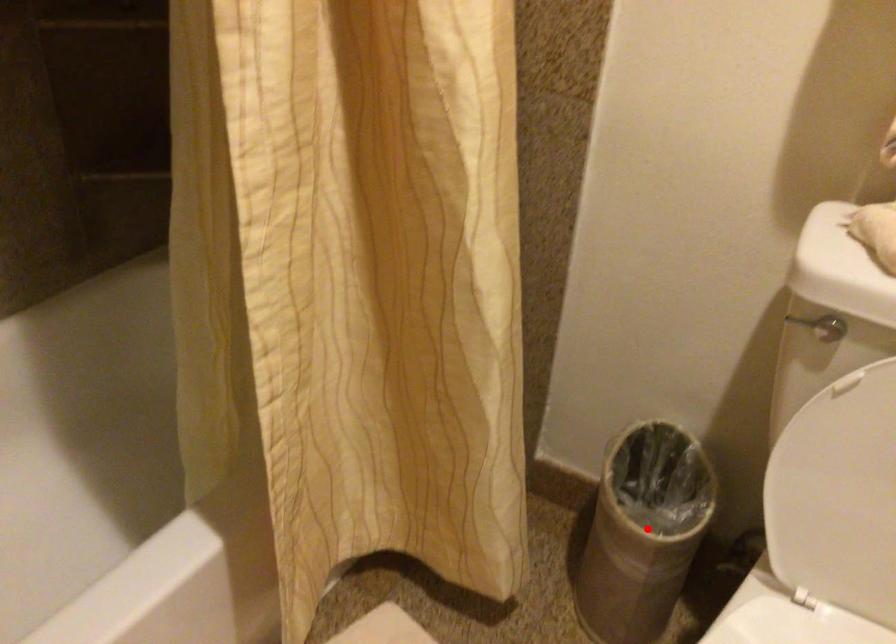
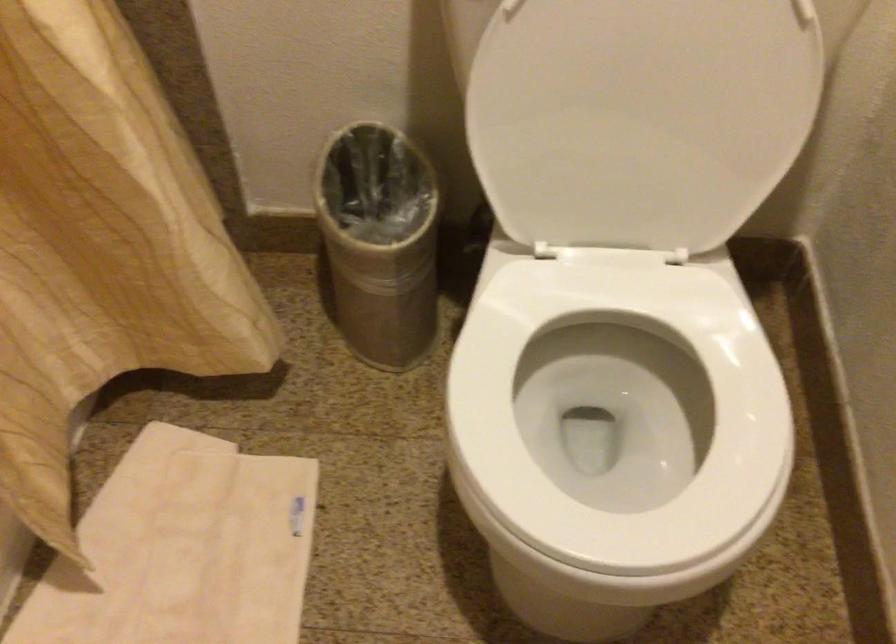
In the second image, find the point that corresponds to the highlighted location in the first image.

(380, 242)